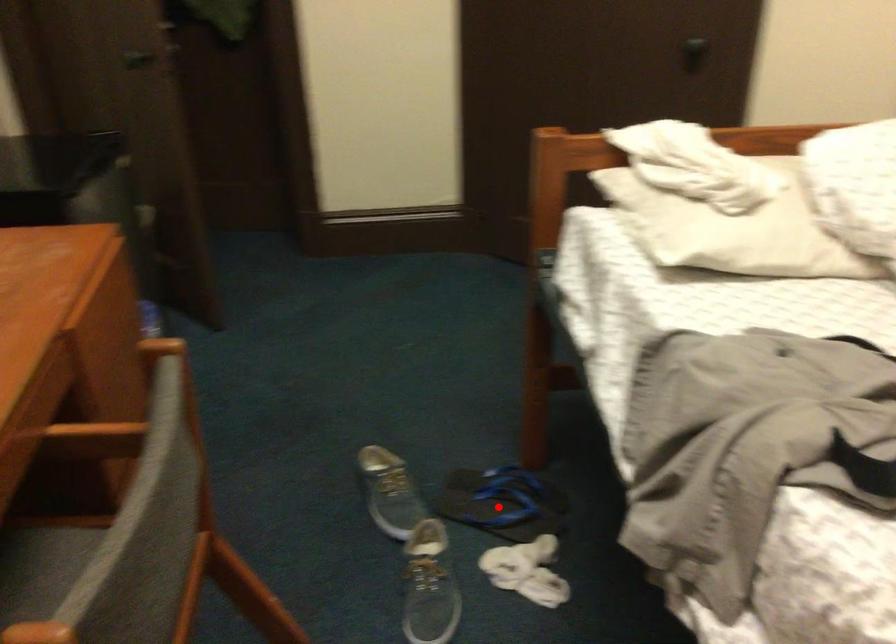
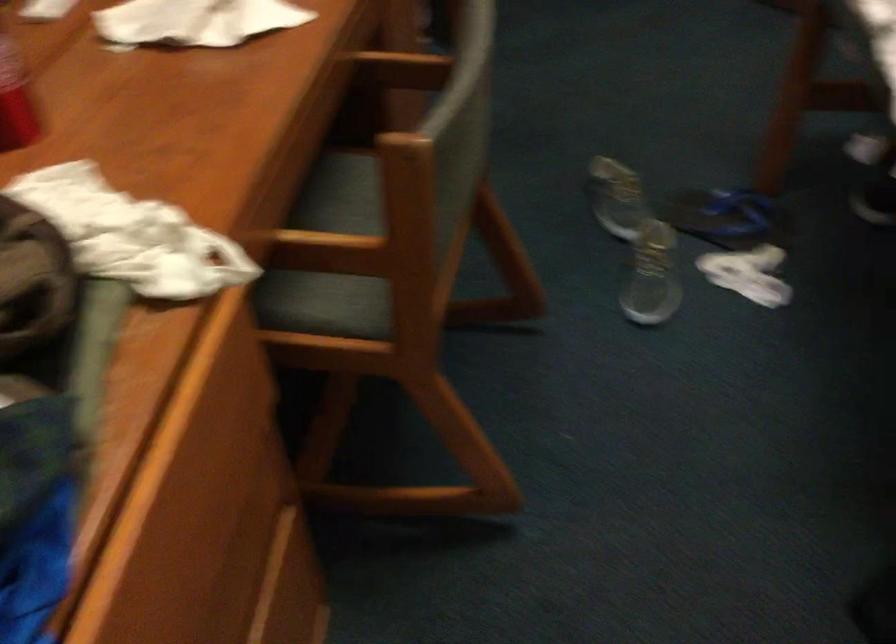
In the second image, find the point that corresponds to the highlighted location in the first image.

(728, 218)